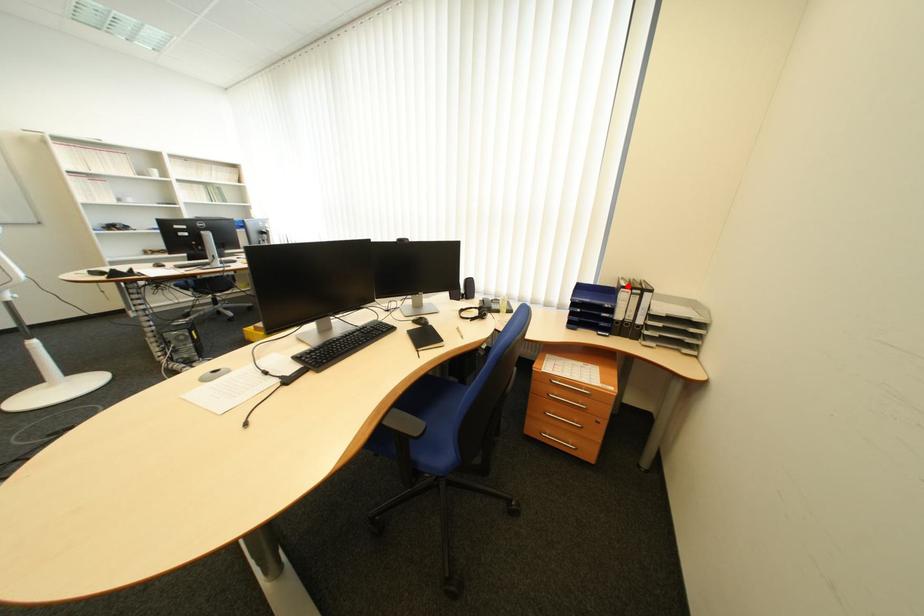
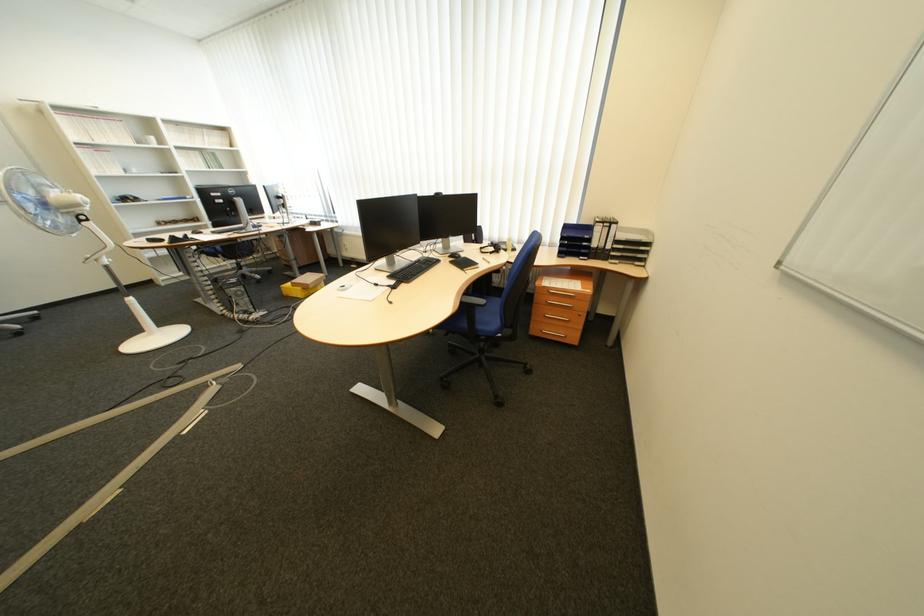
Question: I am providing you with two images of the same scene from different viewpoints. A red point is marked on the first image. Can you still see the location of the red point in image 2?

Choices:
 (A) Yes
 (B) No

Answer: (A)